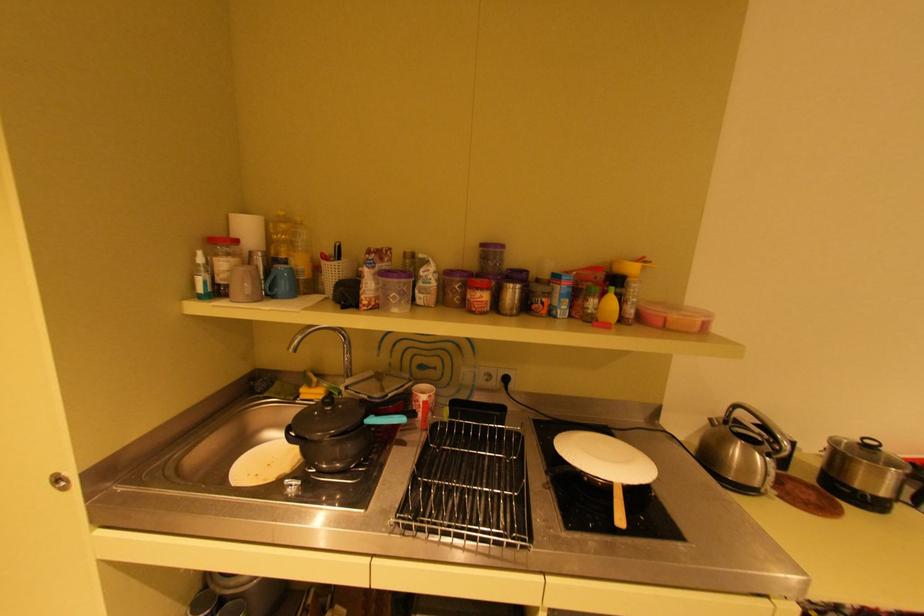
The image size is (924, 616). What do you see at coordinates (271, 285) in the screenshot?
I see `a blue mug handle` at bounding box center [271, 285].